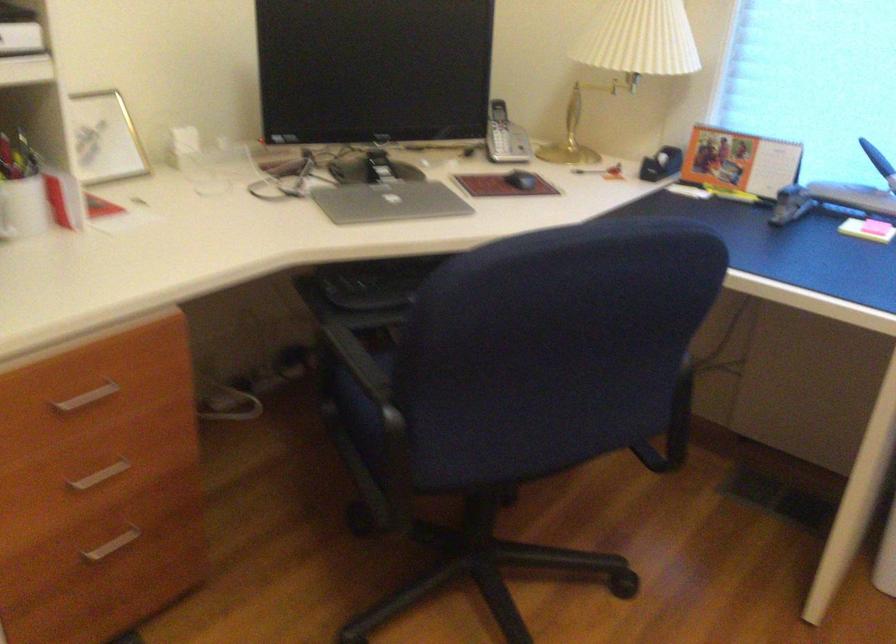
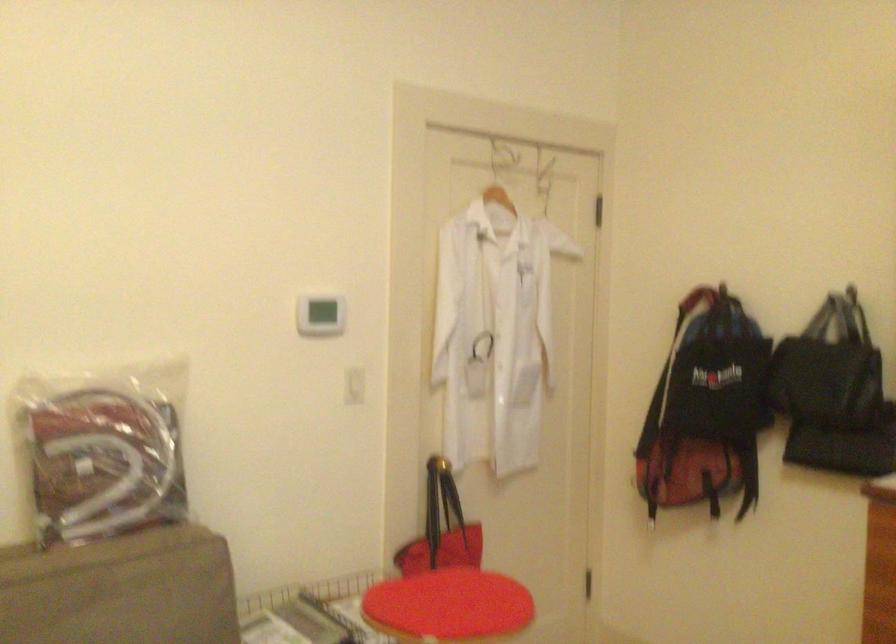
Question: How did the camera likely rotate?

Choices:
 (A) Left
 (B) Right
 (C) Up
 (D) Down

Answer: (A)